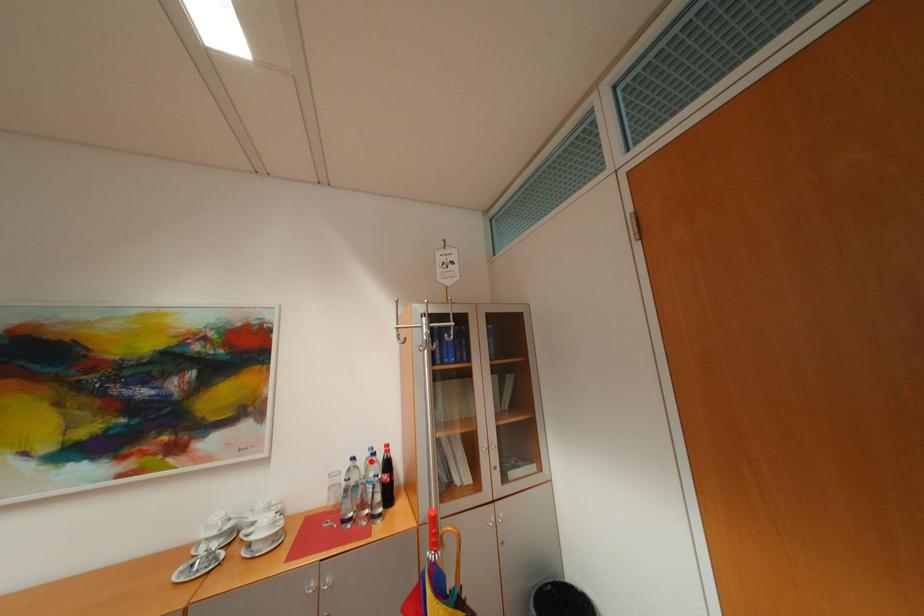
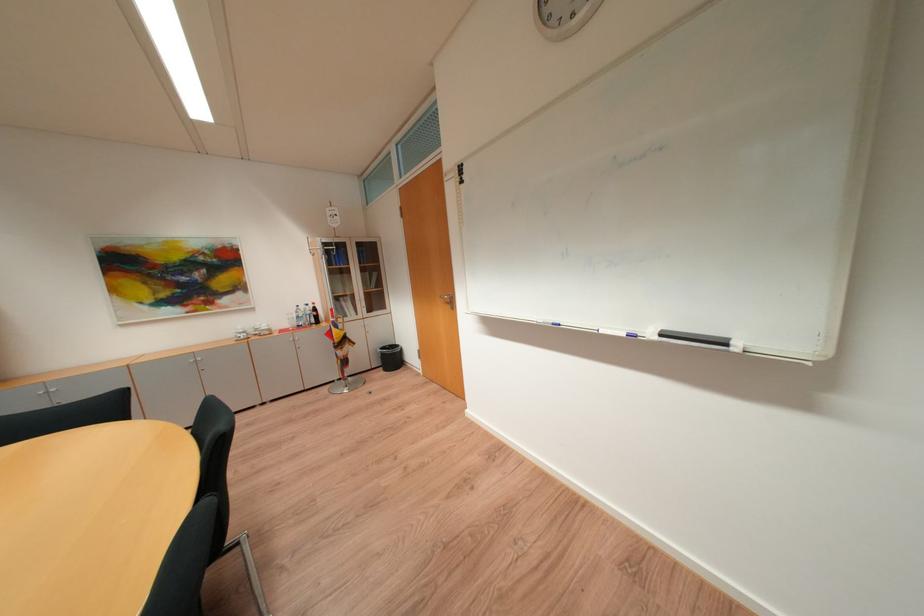
In the second image, find the point that corresponds to the highlighted location in the first image.

(310, 309)